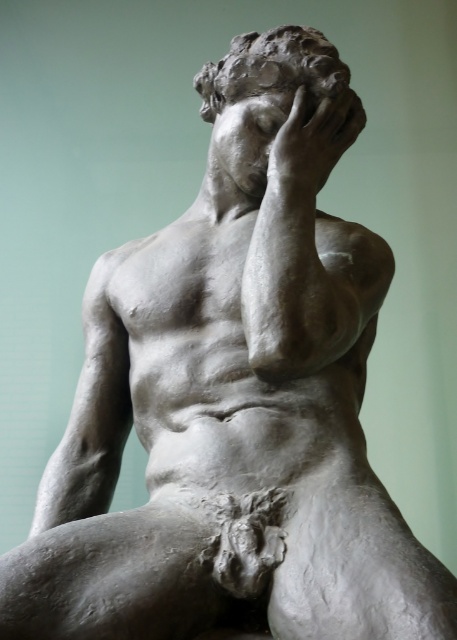
What are the coordinates of the matte gray sculpture at center?

The coordinates of the matte gray sculpture at center are [271,67].